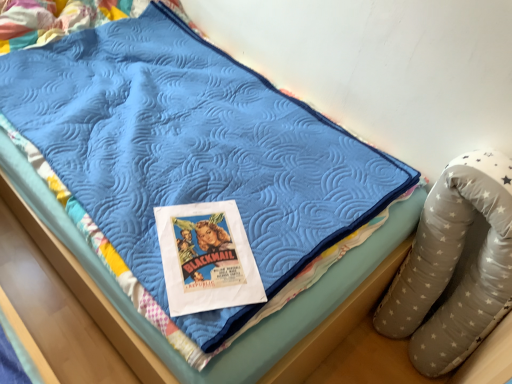
Question: Is point (475, 284) closer or farther from the camera than point (197, 228)?

Choices:
 (A) closer
 (B) farther

Answer: (B)

Question: In terms of size, does gray star-patterned bean bag chair at right appear bigger or smaller than matte paper poster at center?

Choices:
 (A) big
 (B) small

Answer: (A)

Question: Is gray star-patterned bean bag chair at right to the left or to the right of matte paper poster at center in the image?

Choices:
 (A) right
 (B) left

Answer: (A)

Question: Considering the positions of matte paper poster at center and gray star-patterned bean bag chair at right in the image, is matte paper poster at center bigger or smaller than gray star-patterned bean bag chair at right?

Choices:
 (A) big
 (B) small

Answer: (B)

Question: Is matte paper poster at center inside or outside of gray star-patterned bean bag chair at right?

Choices:
 (A) inside
 (B) outside

Answer: (B)

Question: Is point (184, 307) positioned closer to the camera than point (462, 329)?

Choices:
 (A) closer
 (B) farther

Answer: (A)

Question: In terms of width, does matte paper poster at center look wider or thinner when compared to gray star-patterned bean bag chair at right?

Choices:
 (A) thin
 (B) wide

Answer: (B)